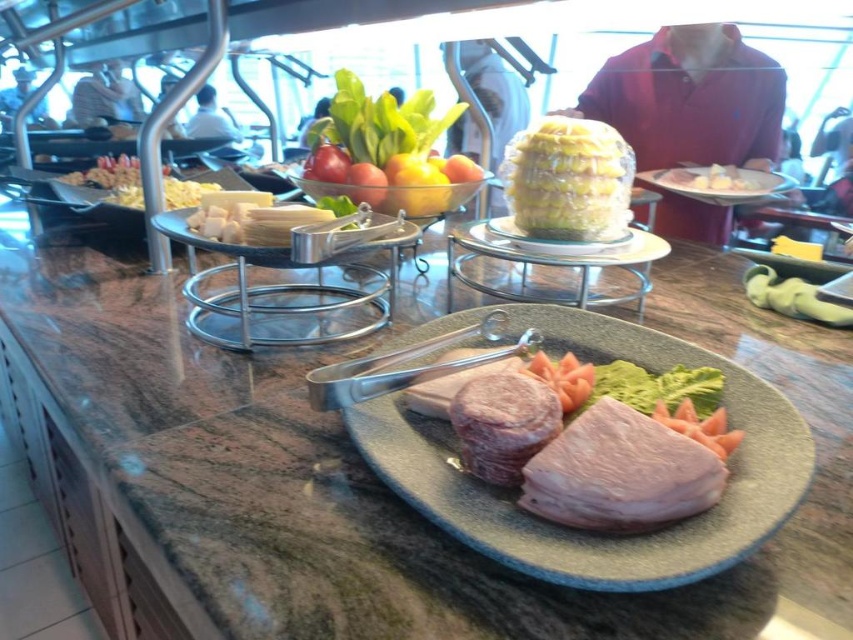
Question: Which of the following is the closest to the observer?

Choices:
 (A) shiny green lettuce at center
 (B) pinkish smooth sausage at center
 (C) yellow plastic corn at center

Answer: (B)

Question: Can you confirm if shiny green lettuce at center is wider than yellow plastic corn at center?

Choices:
 (A) yes
 (B) no

Answer: (A)

Question: Is pink matte meat at center wider than yellow plastic corn at center?

Choices:
 (A) no
 (B) yes

Answer: (B)

Question: Is green marble counter at center bigger than white plastic plate at center?

Choices:
 (A) no
 (B) yes

Answer: (B)

Question: Which point is closer to the camera taking this photo?

Choices:
 (A) (401, 204)
 (B) (558, 172)
 (C) (619, 228)

Answer: (B)

Question: Which point is closer to the camera?

Choices:
 (A) (x=410, y=600)
 (B) (x=618, y=241)
 (C) (x=764, y=476)
 (D) (x=379, y=96)

Answer: (A)